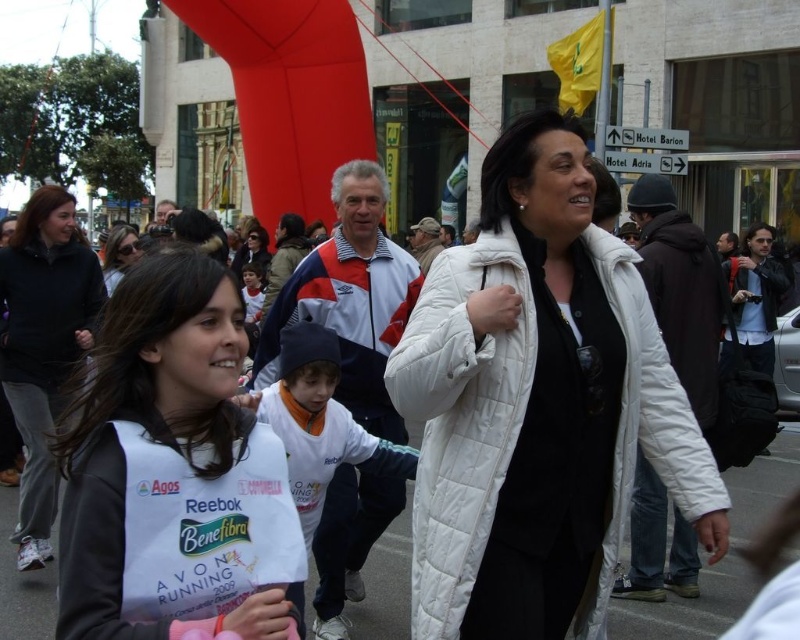
Can you confirm if black fleece vest at center is positioned below white cotton shirt at center?

Yes, black fleece vest at center is below white cotton shirt at center.

Does point (222, 436) come closer to viewer compared to point (244, 266)?

Yes, point (222, 436) is in front of point (244, 266).

Is point (141, 486) closer to viewer compared to point (248, 305)?

That is True.

Where is `black fleece vest at center`? This screenshot has height=640, width=800. black fleece vest at center is located at coordinates (174, 472).

Is white fleece jacket at center to the right of matte white jacket at center from the viewer's perspective?

Indeed, white fleece jacket at center is positioned on the right side of matte white jacket at center.

Measure the distance between white fleece jacket at center and camera.

white fleece jacket at center is 20.85 meters from camera.

You are a GUI agent. You are given a task and a screenshot of the screen. Output one action in this format:
    pyautogui.click(x=<x>, y=<y>)
    Task: Click on the white fleece jacket at center
    This screenshot has height=640, width=800.
    Given the screenshot: What is the action you would take?
    pyautogui.click(x=320, y=422)

Can you confirm if black fleece jacket at lower left is positioned to the left of white cotton shirt at center?

Yes, black fleece jacket at lower left is to the left of white cotton shirt at center.

Which is behind, point (52, 237) or point (248, 296)?

The point (248, 296) is behind.

Does point (20, 289) come behind point (244, 300)?

Yes, point (20, 289) is farther from viewer.

Where is `black fleece jacket at lower left`? The image size is (800, 640). black fleece jacket at lower left is located at coordinates (44, 346).